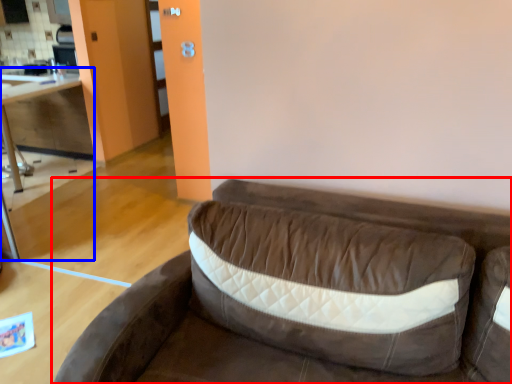
Question: Among these objects, which one is farthest to the camera, studio couch (highlighted by a red box) or table (highlighted by a blue box)?

Choices:
 (A) studio couch
 (B) table

Answer: (B)